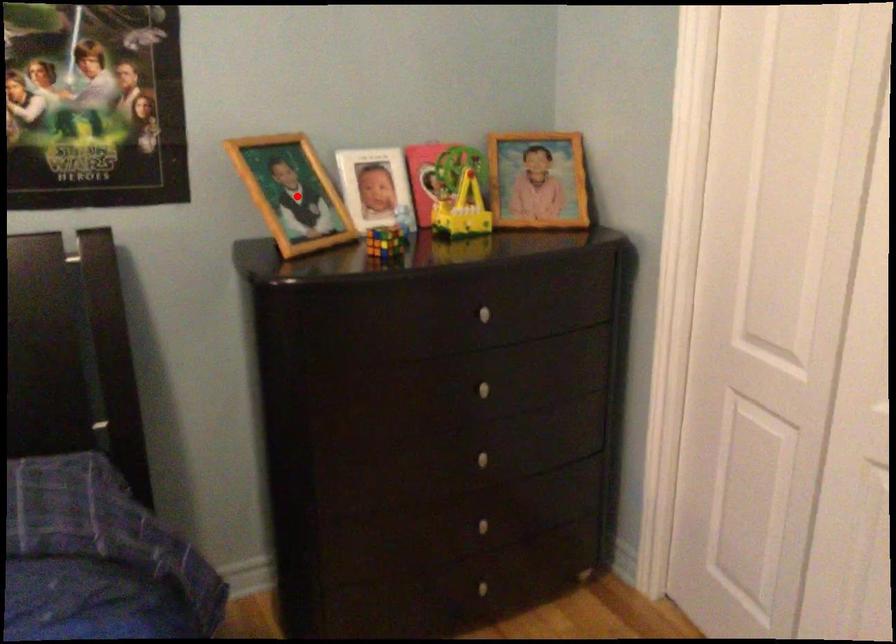
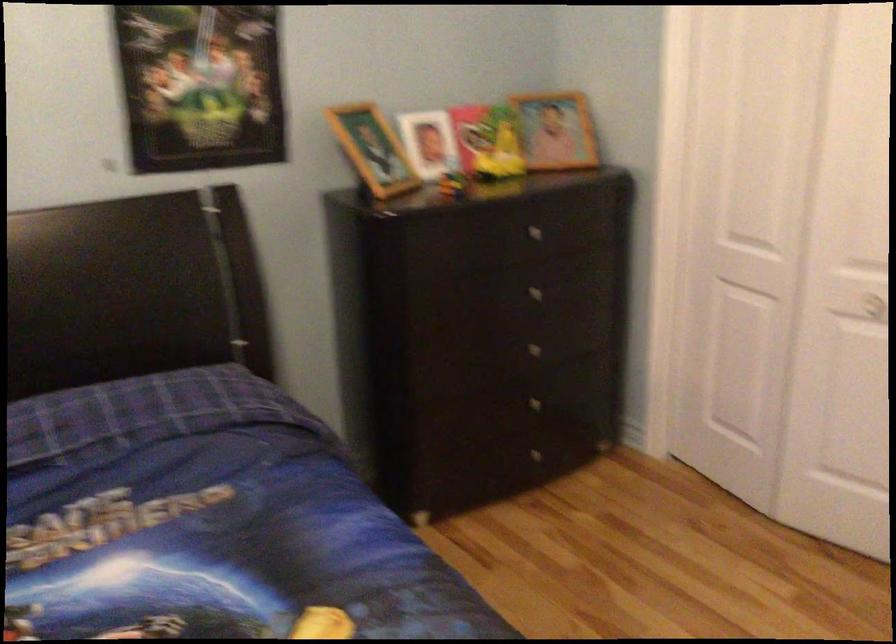
In the second image, find the point that corresponds to the highlighted location in the first image.

(373, 149)